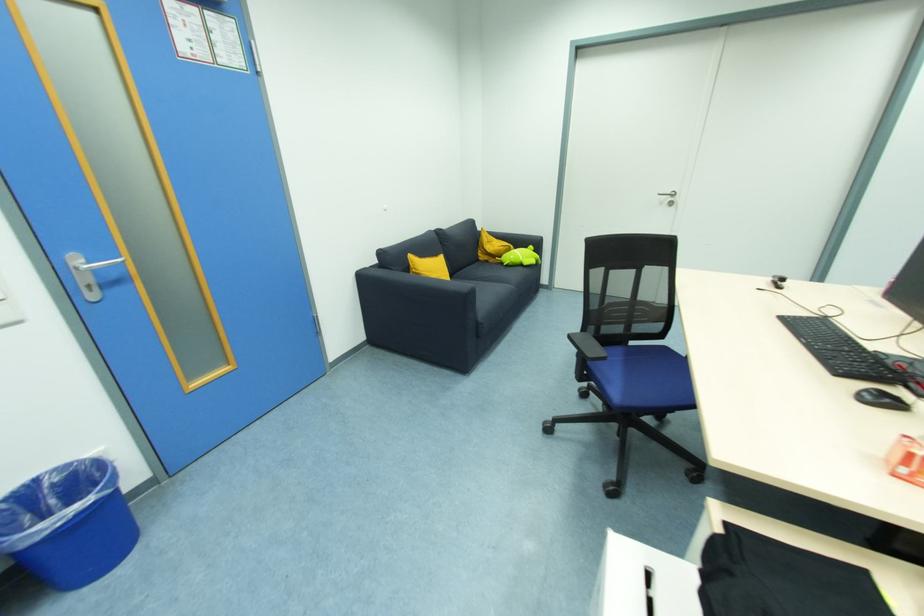
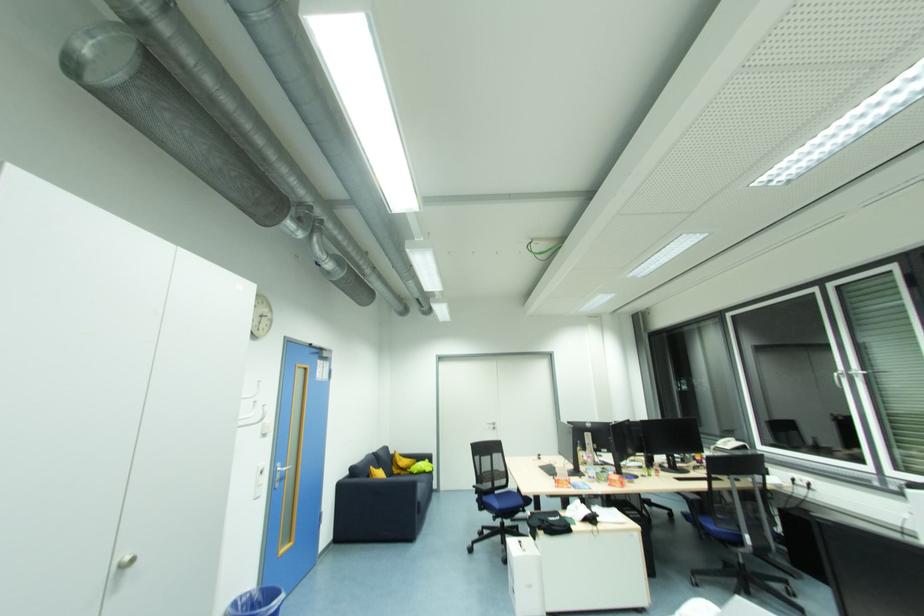
Where in the second image is the point corresponding to the point at 533,248 from the first image?

(430, 461)